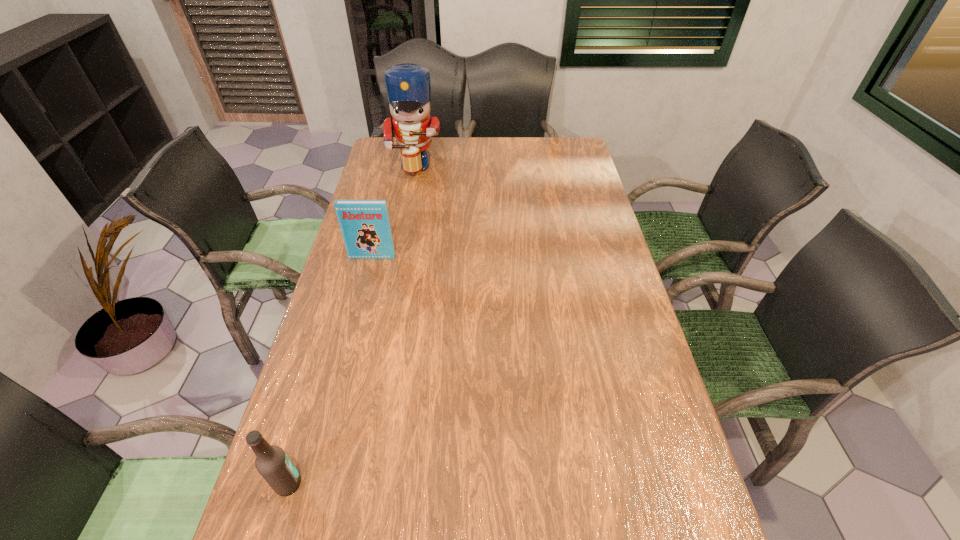
Locate an element on the screen. free area in between the beer bottle and the second nearest object is located at coordinates (330, 370).

Identify which object is the nearest to the tallest object. Please provide its 2D coordinates. Your answer should be formatted as a tuple, i.e. [(x, y)], where the tuple contains the x and y coordinates of a point satisfying the conditions above.

[(365, 225)]

The height and width of the screenshot is (540, 960). What are the coordinates of `object that is the nearest to the nearest object` in the screenshot? It's located at (365, 225).

This screenshot has height=540, width=960. What are the coordinates of `blank area in the image that satisfies the following two spatial constraints: 1. on the front cover of the book; 2. on the label of the beer bottle` in the screenshot? It's located at (x=315, y=484).

Locate an element on the screen. Image resolution: width=960 pixels, height=540 pixels. vacant space that satisfies the following two spatial constraints: 1. on the front-facing side of the nutcracker; 2. on the label of the beer bottle is located at coordinates (341, 484).

Find the location of `vacant region that satisfies the following two spatial constraints: 1. on the front cover of the book; 2. on the label of the nearest object`. vacant region that satisfies the following two spatial constraints: 1. on the front cover of the book; 2. on the label of the nearest object is located at coordinates (315, 484).

I want to click on vacant point that satisfies the following two spatial constraints: 1. on the front cover of the second farthest object; 2. on the label of the beer bottle, so click(315, 484).

At what (x,y) coordinates should I click in order to perform the action: click on free space that satisfies the following two spatial constraints: 1. on the front cover of the book; 2. on the label of the nearest object. Please return your answer as a coordinate pair (x, y). The image size is (960, 540). Looking at the image, I should click on (315, 484).

Identify the location of free location that satisfies the following two spatial constraints: 1. on the front-facing side of the tallest object; 2. on the label of the nearest object. (341, 484).

Where is `vacant point that satisfies the following two spatial constraints: 1. on the front-facing side of the tallest object; 2. on the label of the beer bottle`? Image resolution: width=960 pixels, height=540 pixels. vacant point that satisfies the following two spatial constraints: 1. on the front-facing side of the tallest object; 2. on the label of the beer bottle is located at coordinates (341, 484).